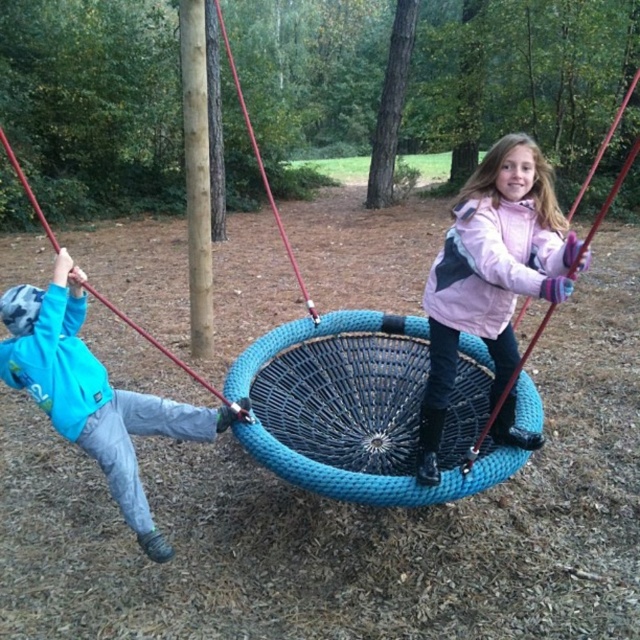
Question: Does pink fleece jacket at center appear under blue fleece sweatshirt at left?

Choices:
 (A) yes
 (B) no

Answer: (B)

Question: Among these objects, which one is farthest from the camera?

Choices:
 (A) blue fleece sweatshirt at left
 (B) pink fleece jacket at center

Answer: (A)

Question: Among these points, which one is nearest to the camera?

Choices:
 (A) (500, 321)
 (B) (212, 419)

Answer: (A)

Question: Is pink fleece jacket at center to the right of pink fleece sweatshirt at upper center from the viewer's perspective?

Choices:
 (A) no
 (B) yes

Answer: (A)

Question: Does blue fleece sweatshirt at left appear on the right side of pink fleece sweatshirt at upper center?

Choices:
 (A) no
 (B) yes

Answer: (A)

Question: Among these points, which one is nearest to the camera?

Choices:
 (A) (480, 246)
 (B) (225, 406)
 (C) (472, 278)

Answer: (A)